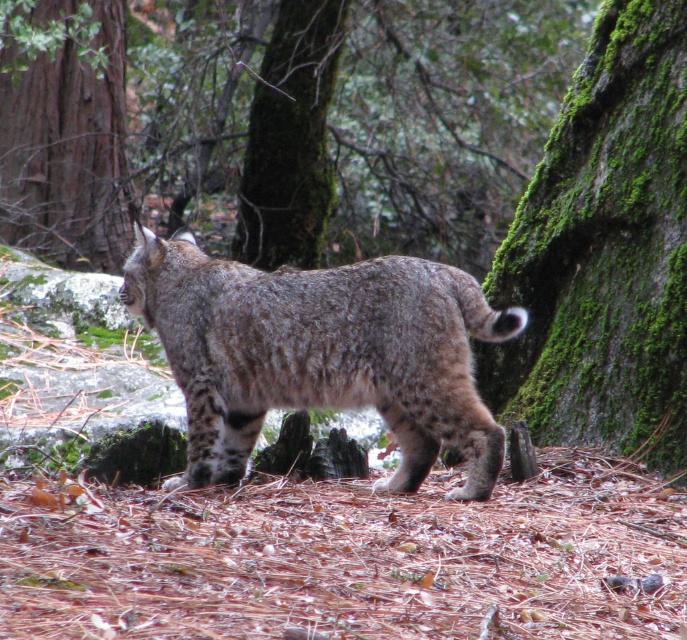
You are a hiker trying to navigate through the forest. You notice a brown rough tree trunk at upper left and a green mossy tree trunk at center. Which tree trunk is wider?

The brown rough tree trunk at upper left is wider than the green mossy tree trunk at center.

You are a wildlife photographer aiming to capture a clear photo of the bobcat. You are currently positioned at the camera location. The bobcat is moving towards the point labeled point (559, 280). If the minimum safe distance to avoid disturbing the bobcat is 15 feet, will the bobcat come within that distance of your position?

The point labeled point (559, 280) is 17.83 feet away from the camera. Since the bobcat is moving towards this point, it will not come closer than 17.83 feet to your position, which is above the minimum safe distance of 15 feet. Therefore, the bobcat will not come within the 15 feet distance required to disturb it.

You are a hiker who wants to take a photo of the brown rough tree trunk at upper left and the green mossy tree trunk at center. Which tree trunk should you focus on first if you are using a camera with a shallow depth of field?

You should focus on the brown rough tree trunk at upper left first because it is positioned over the green mossy tree trunk at center, making it closer to the camera.